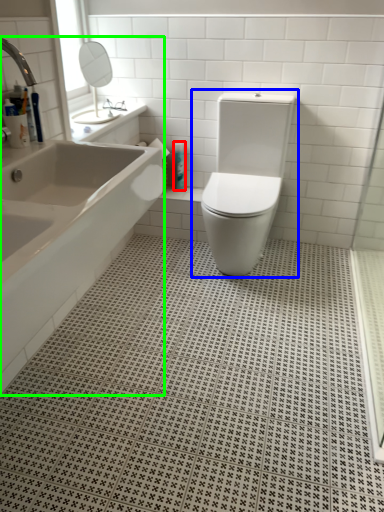
Question: Which is farther away from toiletry (highlighted by a red box)? toilet (highlighted by a blue box) or bathtub (highlighted by a green box)?

Choices:
 (A) toilet
 (B) bathtub

Answer: (B)